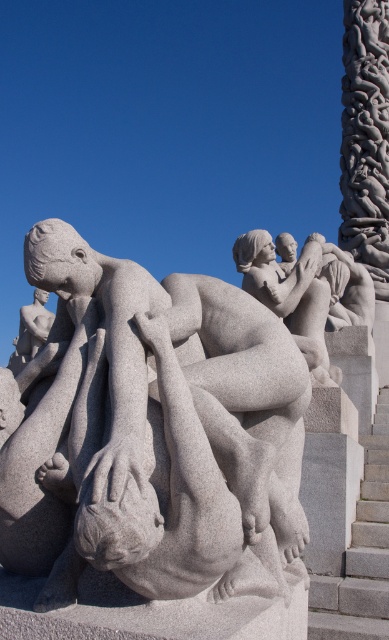
Question: Can you confirm if gray granite sculpture at center is positioned to the left of gray stone stairs at right?

Choices:
 (A) no
 (B) yes

Answer: (B)

Question: Which of the following is the farthest from the observer?

Choices:
 (A) (10, 451)
 (B) (308, 611)

Answer: (B)

Question: Which object is farther from the camera taking this photo?

Choices:
 (A) gray stone stairs at right
 (B) gray granite sculpture at center

Answer: (A)

Question: Is gray granite sculpture at center thinner than gray stone stairs at right?

Choices:
 (A) yes
 (B) no

Answer: (A)

Question: Does gray granite sculpture at center come behind gray stone stairs at right?

Choices:
 (A) no
 (B) yes

Answer: (A)